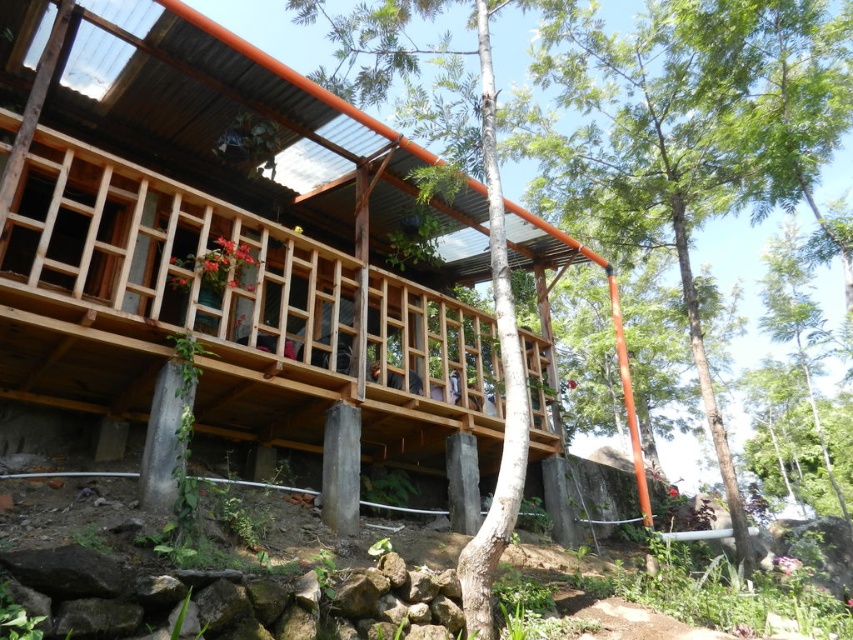
Between point (459, 403) and point (836, 16), which one is positioned in front?

Point (459, 403) is more forward.

Who is higher up, wooden deck at center or green leafy tree at center?

Positioned higher is green leafy tree at center.

You are a GUI agent. You are given a task and a screenshot of the screen. Output one action in this format:
    pyautogui.click(x=<x>, y=<y>)
    Task: Click on the wooden deck at center
    
    Given the screenshot: What is the action you would take?
    pyautogui.click(x=219, y=310)